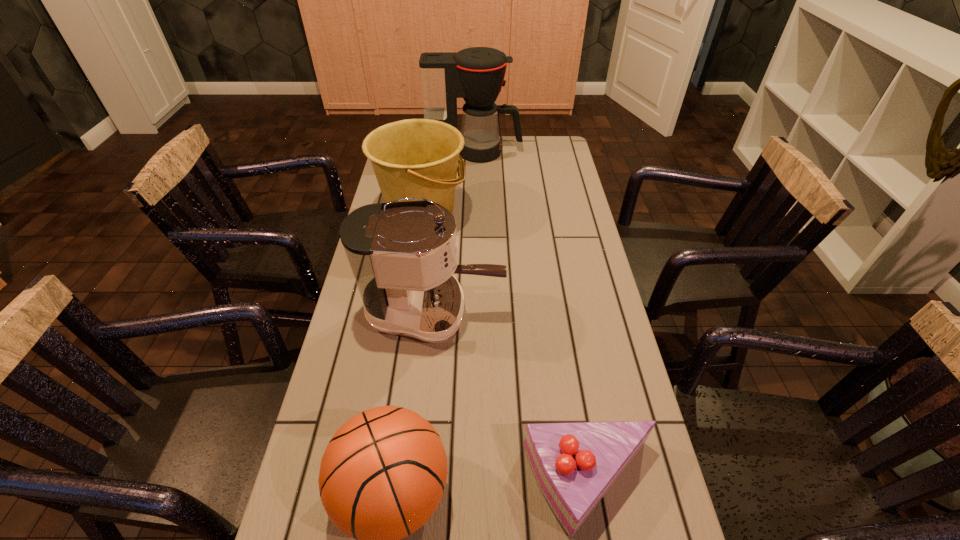
Identify which object is the third closest to the farthest object. Please provide its 2D coordinates. Your answer should be formatted as a tuple, i.e. [(x, y)], where the tuple contains the x and y coordinates of a point satisfying the conditions above.

[(382, 476)]

Select which object appears as the third closest to the fourth tallest object. Please provide its 2D coordinates. Your answer should be formatted as a tuple, i.e. [(x, y)], where the tuple contains the x and y coordinates of a point satisfying the conditions above.

[(414, 158)]

Locate an element on the screen. blank area in the image that satisfies the following two spatial constraints: 1. pour from the carafe of the farther coffee maker; 2. on the right side of the shortest object is located at coordinates (469, 486).

The height and width of the screenshot is (540, 960). I want to click on free spot that satisfies the following two spatial constraints: 1. on the front-facing side of the nearer coffee maker; 2. on the back side of the cake, so click(x=418, y=486).

The width and height of the screenshot is (960, 540). I want to click on free space that satisfies the following two spatial constraints: 1. on the side of the second farthest object with the handle; 2. on the left side of the shortest object, so click(379, 486).